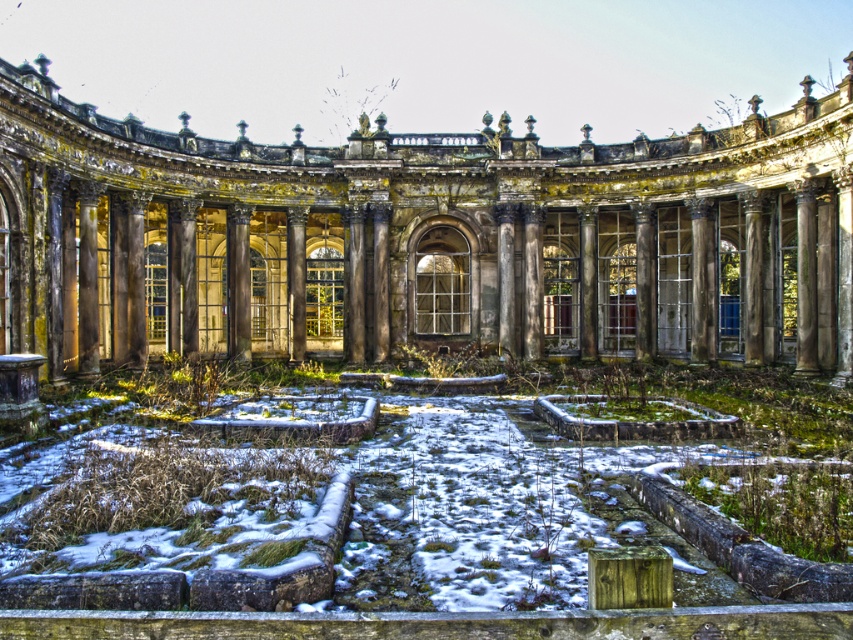
You are standing at the entrance of the abandoned classical building and want to walk to a specific location. There are two points marked in the garden area. One is point (20, 262) and the other is point (480, 522). Which point is closer to you when you first enter the building?

Point (480, 522) is closer to you because point (20, 262) is behind it.

You are standing in the garden of the abandoned building and want to walk towards the weathered stone palace at center. Which direction should you move relative to the white powdery snow at center?

Since the weathered stone palace at center is further to the viewer than the white powdery snow at center, you should move away from the white powdery snow at center to reach the palace.

You are standing at the coordinates 0.5, 0.5 in the image. Which direction should you move to reach the weathered stone palace at center?

Since the weathered stone palace at center is located at point (422, 237) and you are at (426, 320), you should move slightly to the left and down to reach it.